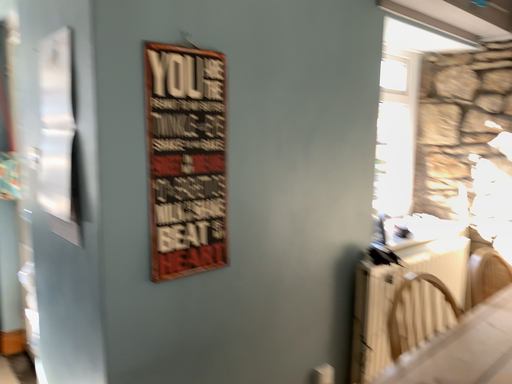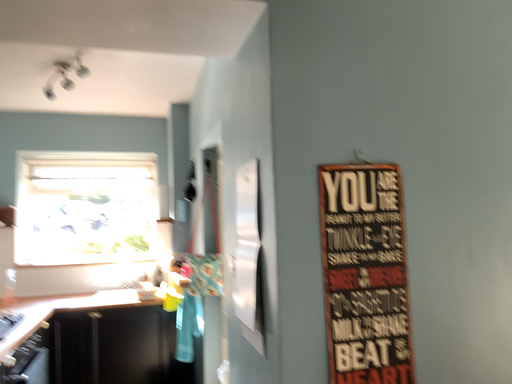
Question: Which way did the camera rotate in the video?

Choices:
 (A) rotated right
 (B) rotated left

Answer: (B)